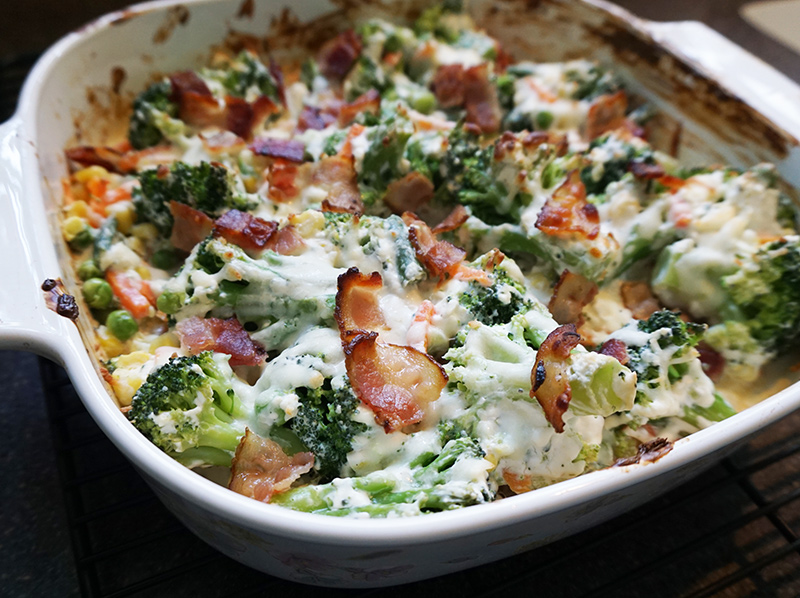
At what (x,y) coordinates should I click in order to perform the action: click on edge of casserole dish. Please return your answer as a coordinate pair (x, y). Looking at the image, I should click on (482, 518).